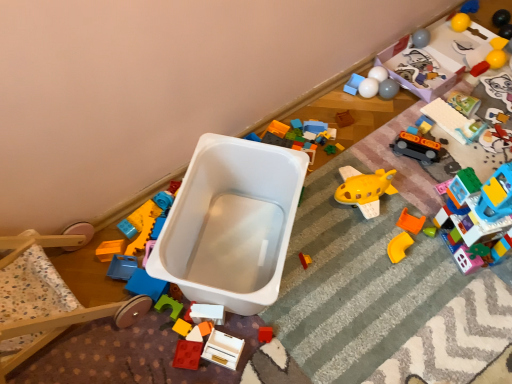
The height and width of the screenshot is (384, 512). Find the location of `vacant area that lies to the right of rubberized red brick at lower center, positioned as the fifteenth toy in right-to-left order`. vacant area that lies to the right of rubberized red brick at lower center, positioned as the fifteenth toy in right-to-left order is located at coordinates (255, 349).